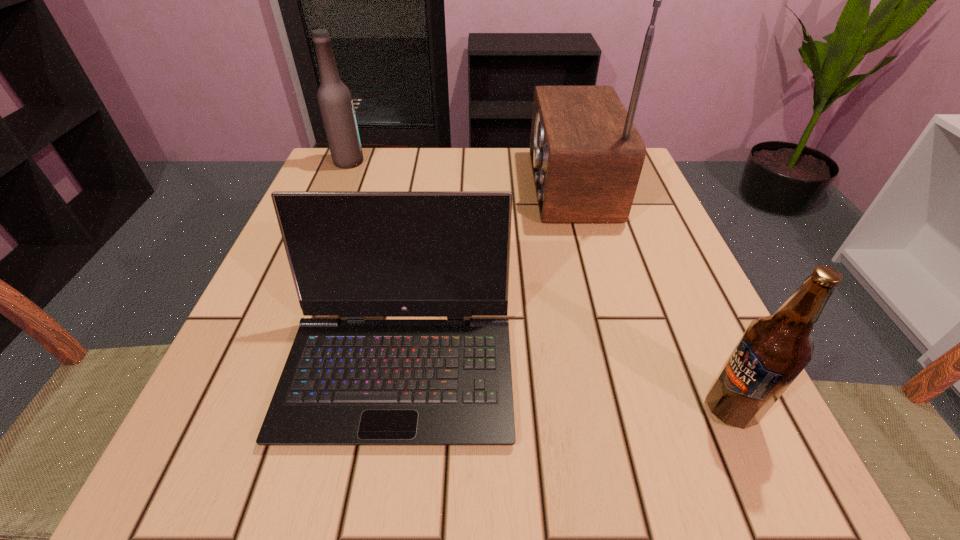
In the image, there is a desktop. Where is `free space at the far left corner`? The image size is (960, 540). free space at the far left corner is located at coordinates (330, 163).

Image resolution: width=960 pixels, height=540 pixels. I want to click on vacant space at the near right corner, so click(686, 458).

Image resolution: width=960 pixels, height=540 pixels. What are the coordinates of `vacant space that is in between the leftmost object and the right beer bottle` in the screenshot? It's located at (540, 285).

The image size is (960, 540). I want to click on empty space that is in between the rightmost object and the farther beer bottle, so click(540, 285).

What are the coordinates of `vacant area between the laptop computer and the right beer bottle` in the screenshot? It's located at point(565,388).

This screenshot has width=960, height=540. What are the coordinates of `free space between the laptop computer and the nearer beer bottle` in the screenshot? It's located at (565, 388).

Identify the location of empty space between the left beer bottle and the rightmost object. (x=540, y=285).

Locate an element on the screen. The image size is (960, 540). free space between the third object from left to right and the right beer bottle is located at coordinates (650, 297).

What are the coordinates of `empty space between the nearer beer bottle and the left beer bottle` in the screenshot? It's located at (540, 285).

Point out which object is positioned as the second nearest to the left beer bottle. Please provide its 2D coordinates. Your answer should be formatted as a tuple, i.e. [(x, y)], where the tuple contains the x and y coordinates of a point satisfying the conditions above.

[(346, 382)]